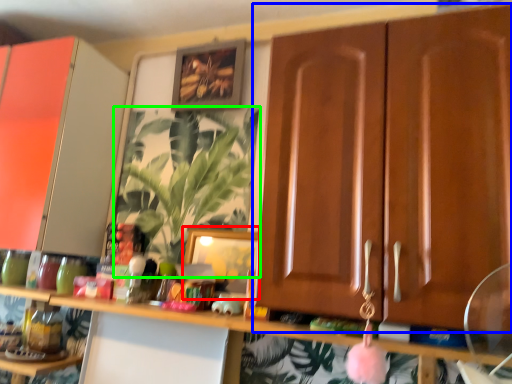
Question: Considering the real-world distances, which object is farthest from picture frame (highlighted by a red box)? cabinetry (highlighted by a blue box) or houseplant (highlighted by a green box)?

Choices:
 (A) cabinetry
 (B) houseplant

Answer: (A)